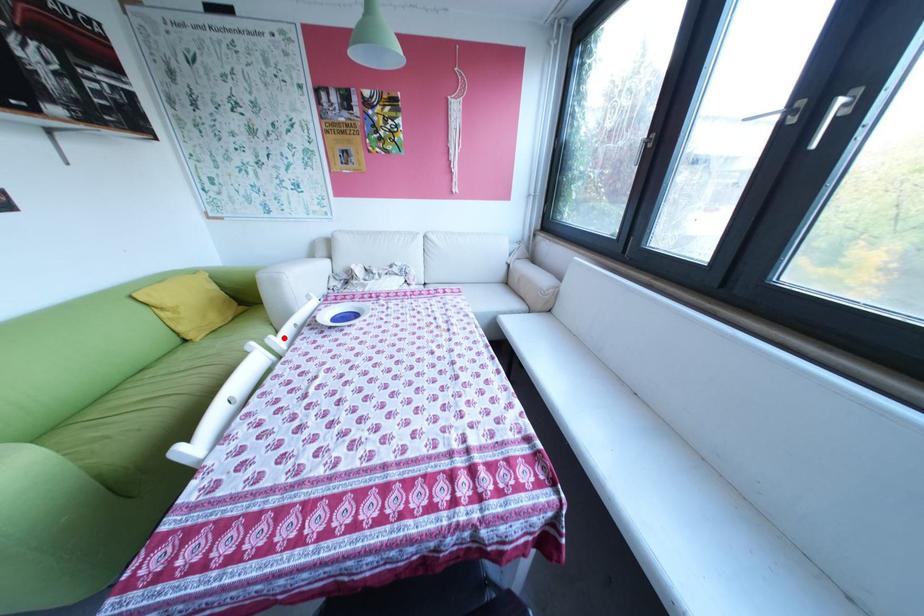
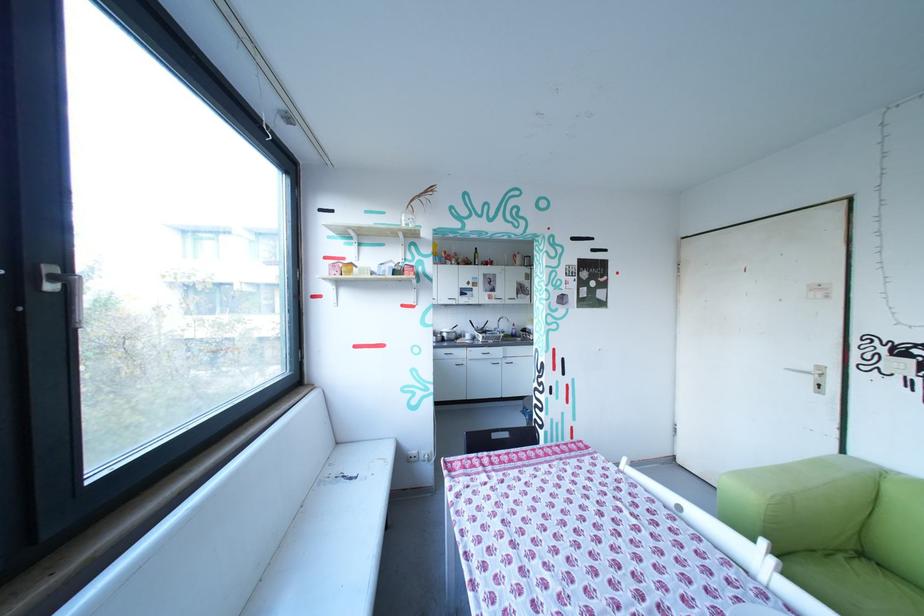
The point at the highlighted location is marked in the first image. Where is the corresponding point in the second image?

(785, 562)